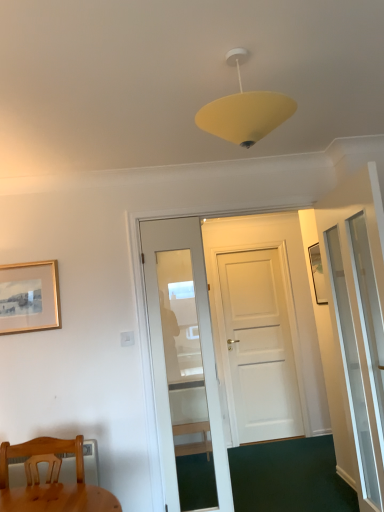
Question: Is transparent glass screen door at right inside or outside of wooden chair at lower left?

Choices:
 (A) inside
 (B) outside

Answer: (B)

Question: From a real-world perspective, is transparent glass screen door at right physically located above or below wooden chair at lower left?

Choices:
 (A) above
 (B) below

Answer: (A)

Question: Based on their relative distances, which object is nearer to the transparent glass screen door at right?

Choices:
 (A) gold metallic picture frame at upper left
 (B) wooden chair at lower left

Answer: (B)

Question: Estimate the real-world distances between objects in this image. Which object is closer to the wooden chair at lower left?

Choices:
 (A) transparent glass screen door at right
 (B) gold metallic picture frame at upper left

Answer: (B)